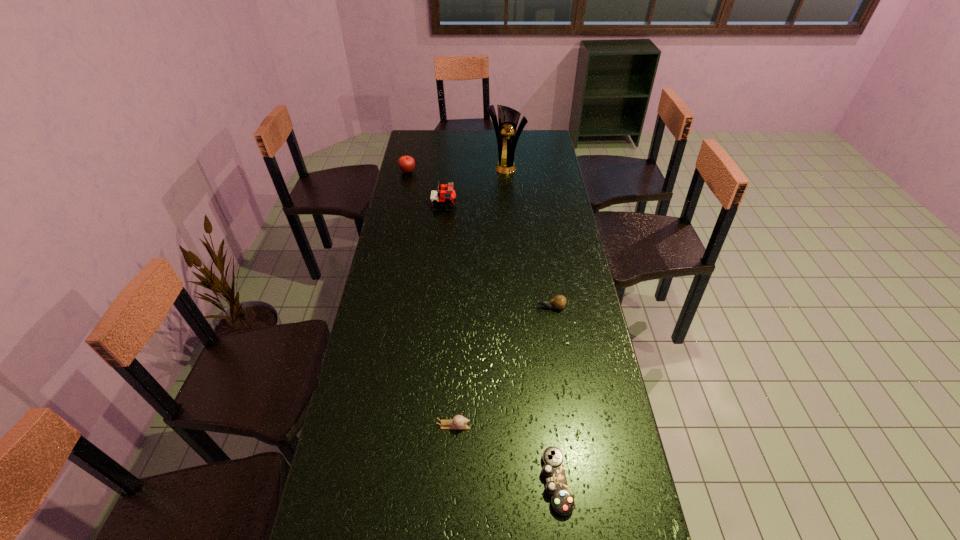
Where is `escargot situated at the right edge`? escargot situated at the right edge is located at coordinates [x=559, y=301].

The image size is (960, 540). Identify the location of control that is at the right edge. coord(562,502).

Image resolution: width=960 pixels, height=540 pixels. What are the coordinates of `free space at the far edge of the desktop` in the screenshot? It's located at (441, 152).

Identify the location of vacant space at the left edge of the desktop. The width and height of the screenshot is (960, 540). (410, 218).

Find the location of a particular element. This screenshot has width=960, height=540. vacant space at the right edge of the desktop is located at coordinates (575, 256).

The image size is (960, 540). What are the coordinates of `free spot at the far left corner of the desktop` in the screenshot? It's located at (404, 151).

Where is `vacant space that's between the farther escargot and the award`? The image size is (960, 540). vacant space that's between the farther escargot and the award is located at coordinates (528, 237).

You are a GUI agent. You are given a task and a screenshot of the screen. Output one action in this format:
    pyautogui.click(x=<x>, y=<y>)
    Task: Click on the vacant area between the leftmost object and the control
    The height and width of the screenshot is (540, 960).
    Given the screenshot: What is the action you would take?
    pyautogui.click(x=482, y=327)

Find the location of a particular element. The height and width of the screenshot is (540, 960). vacant space in between the award and the control is located at coordinates (531, 323).

Identify the location of free point between the control and the Lego. The image size is (960, 540). (500, 343).